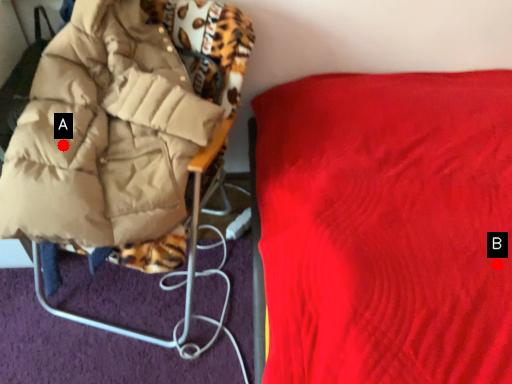
Question: Two points are circled on the image, labeled by A and B beside each circle. Which point appears farthest from the camera in this image?

Choices:
 (A) A is further
 (B) B is further

Answer: (A)